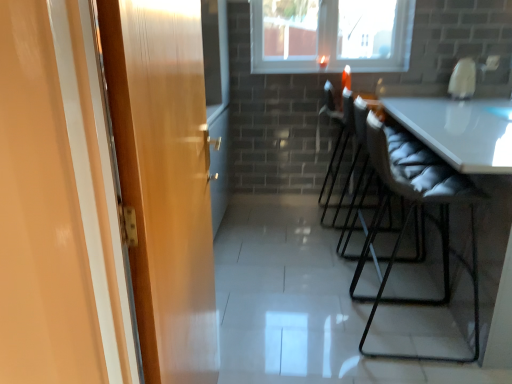
Question: Is gray quilted cushion at right, which appears as the third chair when viewed from the back, bigger or smaller than black leather chair at center, acting as the 1th chair starting from the back?

Choices:
 (A) big
 (B) small

Answer: (A)

Question: Does point (419, 359) appear closer or farther from the camera than point (343, 190)?

Choices:
 (A) farther
 (B) closer

Answer: (B)

Question: Considering the real-world distances, which object is farthest from the gray quilted cushion at right, which appears as the third chair when viewed from the back?

Choices:
 (A) matte gray chair at center right, positioned as the 2th chair in back-to-front order
 (B) wooden door at left
 (C) transparent glass window at upper center
 (D) black leather chair at center, acting as the 1th chair starting from the back

Answer: (C)

Question: Based on their relative distances, which object is farther from the matte gray chair at center right, positioned as the 2th chair in back-to-front order?

Choices:
 (A) wooden door at left
 (B) black leather chair at center, acting as the 1th chair starting from the back
 (C) transparent glass window at upper center
 (D) gray quilted cushion at right, the 1th chair positioned from the front

Answer: (A)